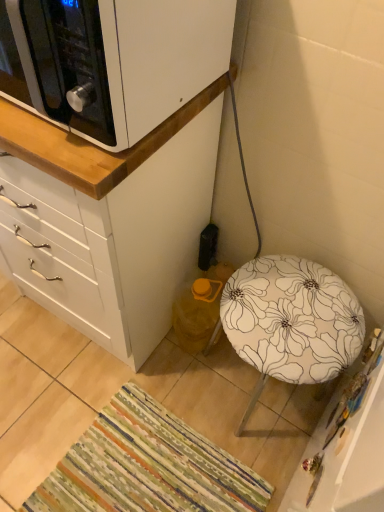
The width and height of the screenshot is (384, 512). I want to click on vacant area on top of multicolored woven mat at lower left (from a real-world perspective), so click(158, 468).